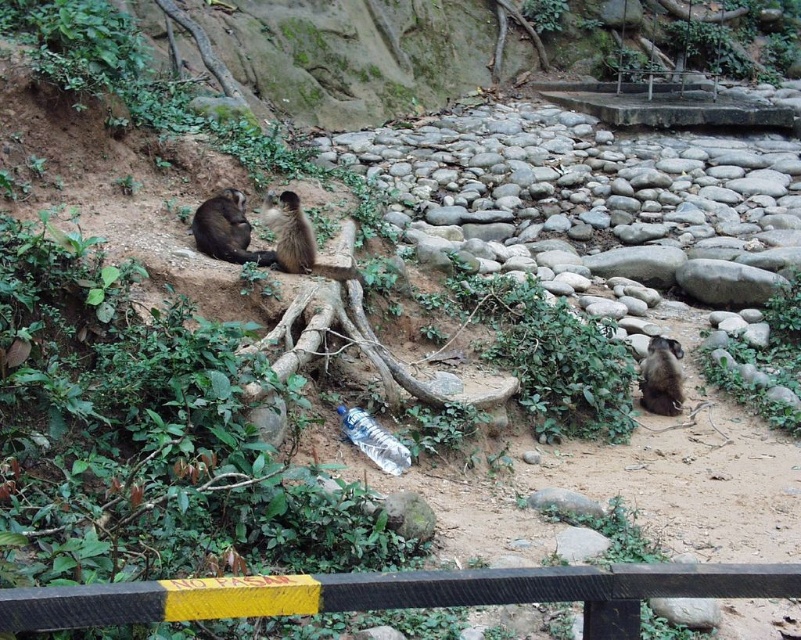
You are a zookeeper who needs to retrieve a transparent plastic bottle at center from the area where the brown fur monkey at center is located. Considering the distance between them, can you safely reach the bottle without entering the restricted zone marked by the wooden barrier with the NO PASE sign?

The distance between the brown fur monkey at center and the transparent plastic bottle at center is 4.84 feet. Since the zookeeper is outside the restricted zone marked by the wooden barrier with the NO PASE sign, they can safely reach the bottle without crossing into the restricted area if the distance from their position to the bottle is within their reach. However, the provided information does not specify the exact location of the zookeeper relative to the barrier or the total distance from the barrier.

Looking at this image, you are a wildlife photographer standing at the camera position. You want to capture a closeup shot of the brown fur monkey at center. Given that your telephoto lens has a minimum focusing distance of 3 meters, can you successfully take the photo?

The brown fur monkey at center and camera are 5.59 meters apart from each other. Since the minimum focusing distance is 3 meters, the telephoto lens can focus at 5.59 meters, so yes, you can successfully take the photo.